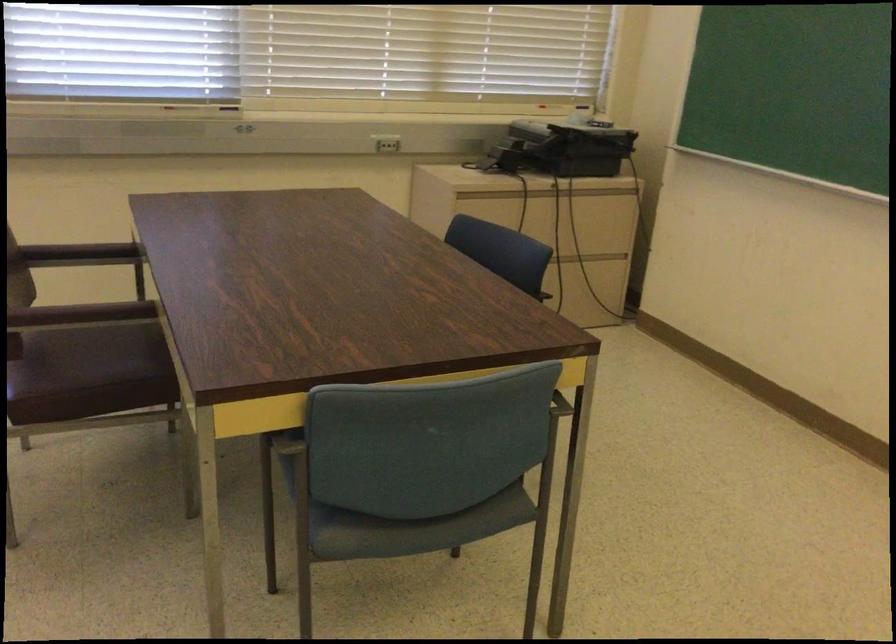
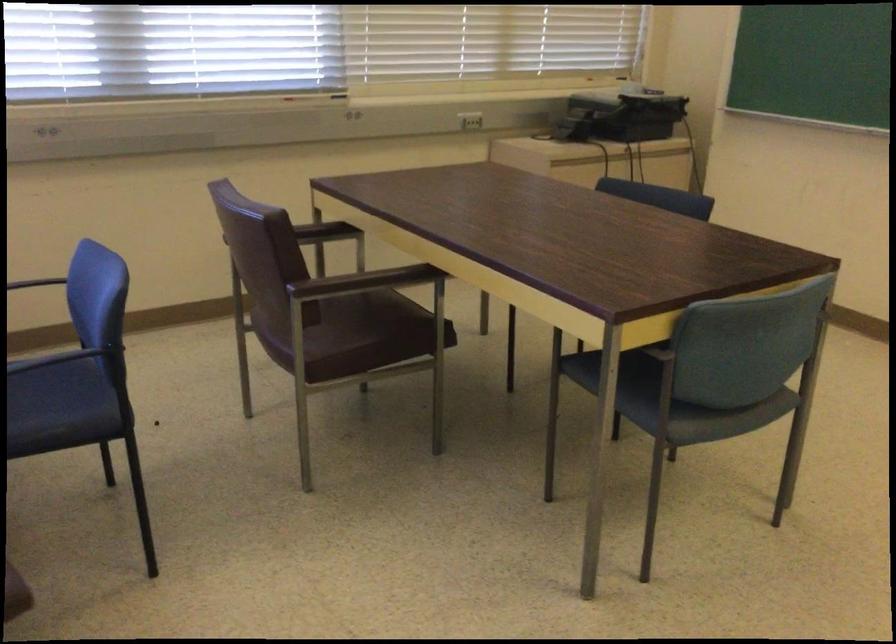
Find the pixel in the second image that matches pixel 116 256 in the first image.

(323, 232)